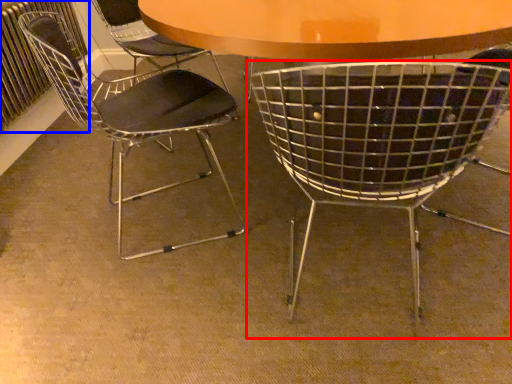
Question: Among these objects, which one is nearest to the camera, chair (highlighted by a red box) or radiator (highlighted by a blue box)?

Choices:
 (A) chair
 (B) radiator

Answer: (A)